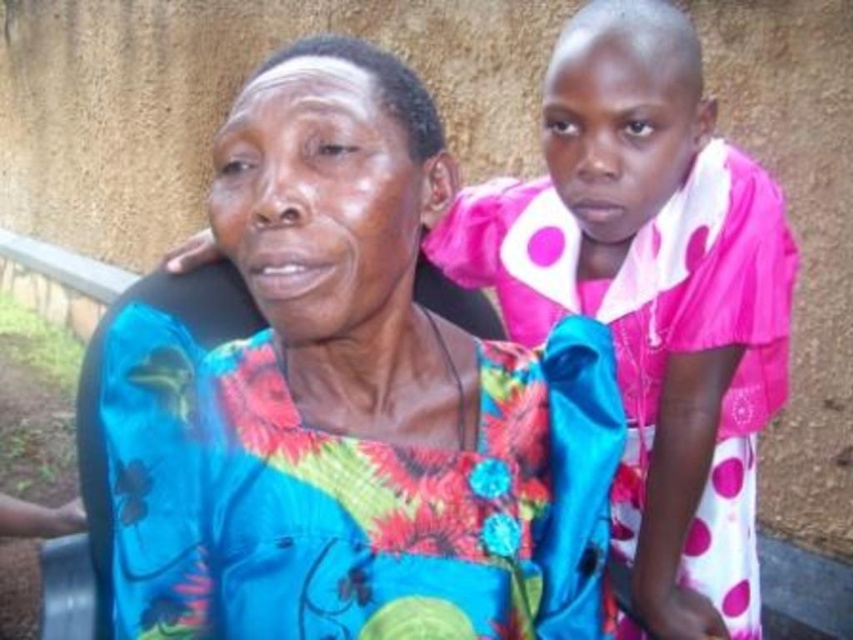
Question: Among these points, which one is nearest to the camera?

Choices:
 (A) (766, 420)
 (B) (468, 598)

Answer: (B)

Question: Does floral satin dress at center have a greater width compared to pink polka dot dress at upper right?

Choices:
 (A) no
 (B) yes

Answer: (A)

Question: Does floral satin dress at center appear on the right side of pink polka dot dress at upper right?

Choices:
 (A) yes
 (B) no

Answer: (B)

Question: Can you confirm if floral satin dress at center is positioned to the right of pink polka dot dress at upper right?

Choices:
 (A) yes
 (B) no

Answer: (B)

Question: Which of the following is the closest to the observer?

Choices:
 (A) pink polka dot dress at upper right
 (B) floral satin dress at center

Answer: (B)